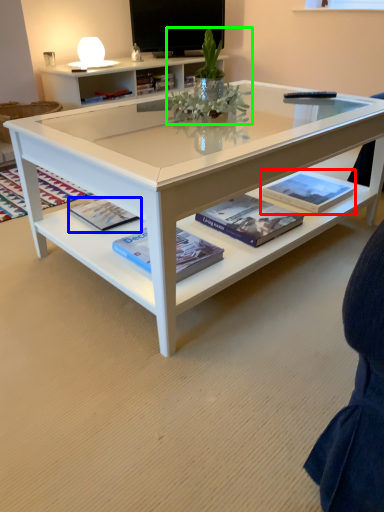
Question: Based on their relative distances, which object is nearer to book (highlighted by a red box)? Choose from paperback book (highlighted by a blue box) and floral arrangement (highlighted by a green box).

Choices:
 (A) paperback book
 (B) floral arrangement

Answer: (B)